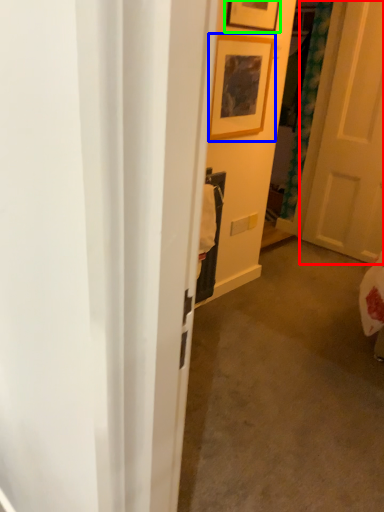
Question: Considering the real-world distances, which object is farthest from door (highlighted by a red box)? picture frame (highlighted by a blue box) or picture frame (highlighted by a green box)?

Choices:
 (A) picture frame
 (B) picture frame

Answer: (B)